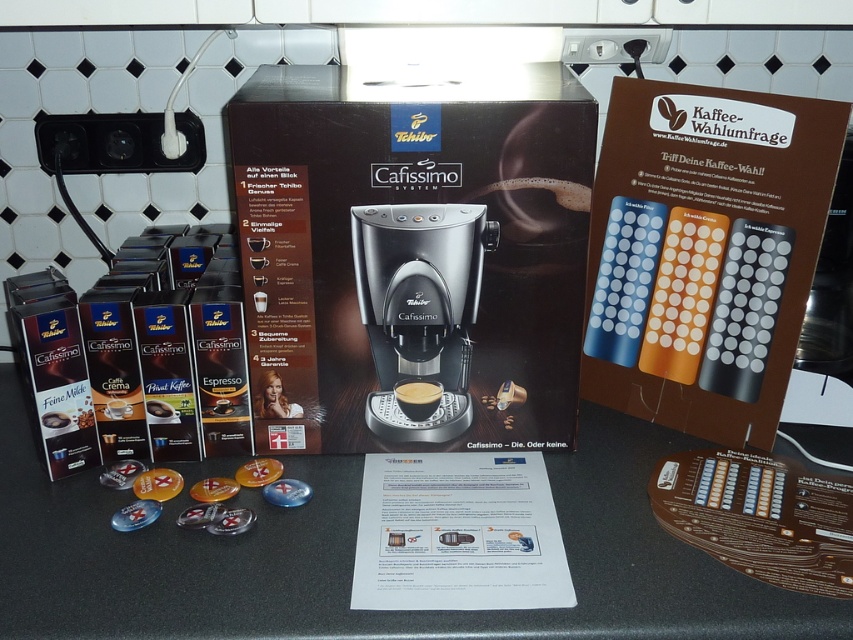
Question: Is black plastic coffee machine at center to the right of black glossy coffee at center from the viewer's perspective?

Choices:
 (A) no
 (B) yes

Answer: (B)

Question: Considering the real-world distances, which object is closest to the black glossy coffee at center?

Choices:
 (A) black matte counter at center
 (B) black plastic coffee machine at center

Answer: (B)

Question: Which object is the farthest from the black glossy coffee at center?

Choices:
 (A) black plastic coffee machine at center
 (B) black matte counter at center

Answer: (B)

Question: Does black matte counter at center have a smaller size compared to black plastic coffee machine at center?

Choices:
 (A) yes
 (B) no

Answer: (B)

Question: Is black matte counter at center wider than black plastic coffee machine at center?

Choices:
 (A) yes
 (B) no

Answer: (A)

Question: Which of the following is the farthest from the observer?

Choices:
 (A) (102, 577)
 (B) (360, 234)

Answer: (B)